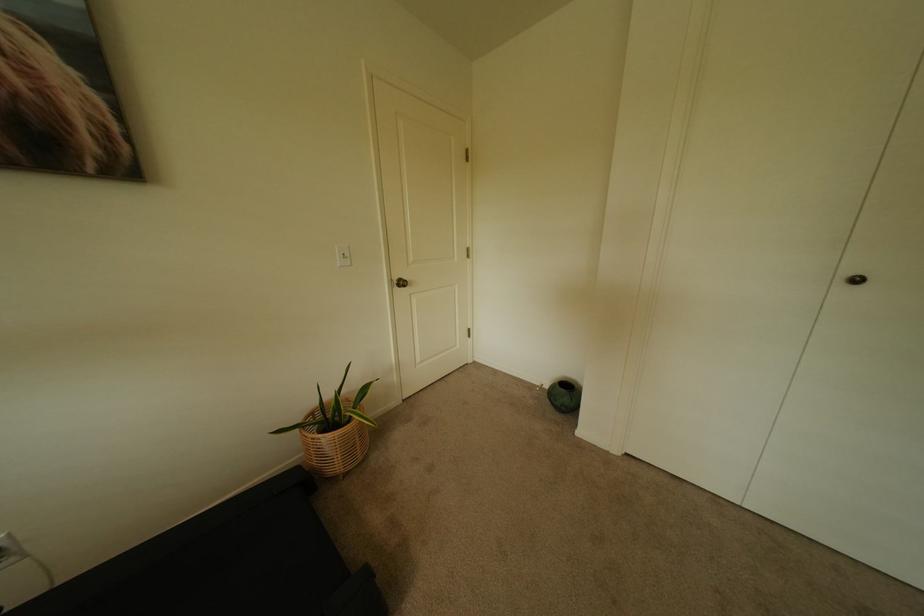
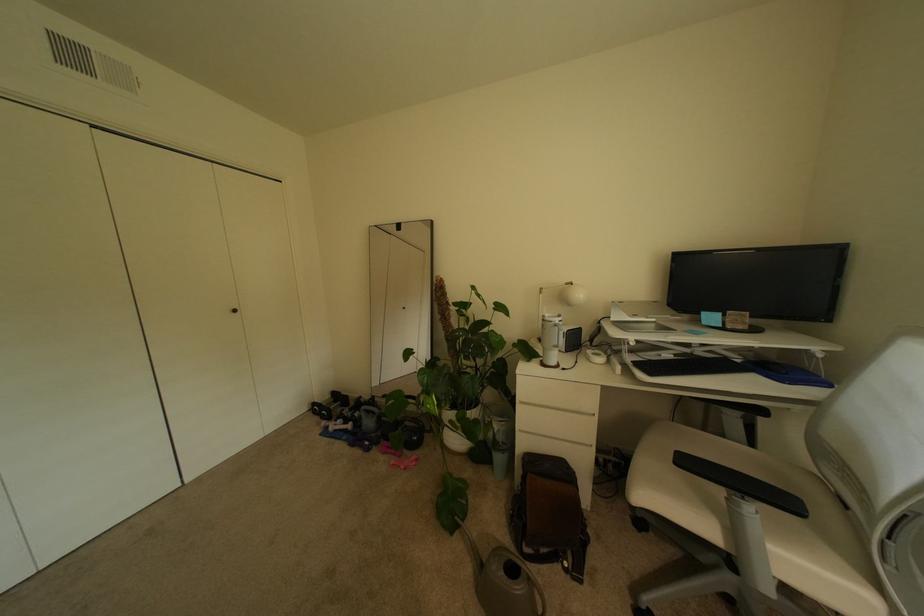
Question: The camera is either moving clockwise (left) or counter-clockwise (right) around the object. The first image is from the beginning of the video and the second image is from the end. Is the camera moving left or right when shooting the video?

Choices:
 (A) Left
 (B) Right

Answer: (A)